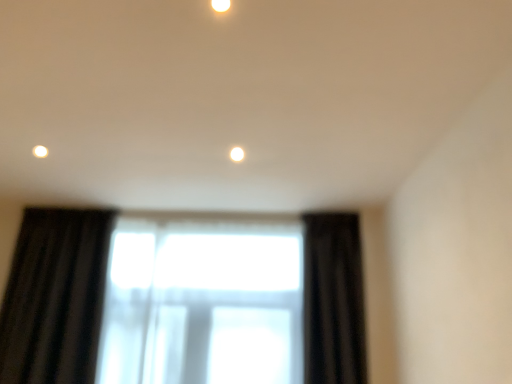
Question: Should I look upward or downward to see black velvet curtain at right?

Choices:
 (A) up
 (B) down

Answer: (B)

Question: From the image's perspective, is black velvet curtain at right on top of matte white light fixture at upper center?

Choices:
 (A) yes
 (B) no

Answer: (B)

Question: Is the position of black velvet curtain at right less distant than that of matte white light fixture at upper center?

Choices:
 (A) yes
 (B) no

Answer: (B)

Question: Could matte white light fixture at upper center be considered to be inside black velvet curtain at right?

Choices:
 (A) no
 (B) yes

Answer: (A)

Question: Are black velvet curtain at right and matte white light fixture at upper center far apart?

Choices:
 (A) no
 (B) yes

Answer: (B)

Question: Does black velvet curtain at right turn towards matte white light fixture at upper center?

Choices:
 (A) yes
 (B) no

Answer: (A)

Question: Is black velvet curtain at right outside of matte white light fixture at upper center?

Choices:
 (A) no
 (B) yes

Answer: (B)

Question: Is black velvet curtain at right oriented away from transparent fabric at center?

Choices:
 (A) no
 (B) yes

Answer: (A)

Question: Is black velvet curtain at right directly adjacent to transparent fabric at center?

Choices:
 (A) no
 (B) yes

Answer: (A)

Question: Considering the relative sizes of black velvet curtain at right and transparent fabric at center in the image provided, is black velvet curtain at right shorter than transparent fabric at center?

Choices:
 (A) no
 (B) yes

Answer: (B)

Question: From a real-world perspective, is black velvet curtain at right below transparent fabric at center?

Choices:
 (A) no
 (B) yes

Answer: (A)

Question: Is black velvet curtain at right aimed at transparent fabric at center?

Choices:
 (A) yes
 (B) no

Answer: (B)

Question: Considering the relative sizes of black velvet curtain at right and transparent fabric at center in the image provided, is black velvet curtain at right wider than transparent fabric at center?

Choices:
 (A) no
 (B) yes

Answer: (B)

Question: From a real-world perspective, is matte white light fixture at upper center over transparent fabric at center?

Choices:
 (A) no
 (B) yes

Answer: (B)